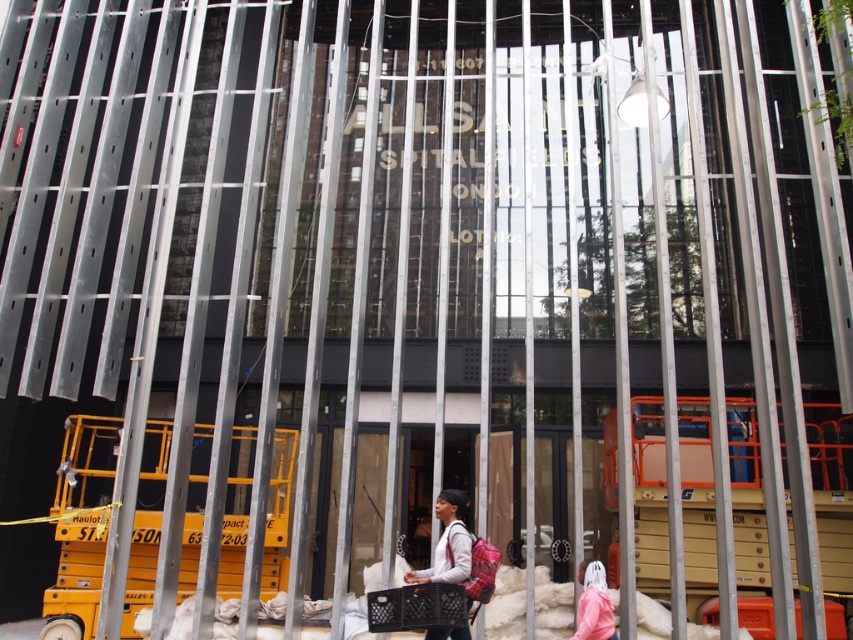
Question: Does plaid fabric backpack at center appear over pink fabric at lower right?

Choices:
 (A) yes
 (B) no

Answer: (B)

Question: Can you confirm if plaid fabric backpack at center is wider than pink fabric at lower right?

Choices:
 (A) yes
 (B) no

Answer: (B)

Question: Is plaid fabric backpack at center smaller than pink fabric at lower right?

Choices:
 (A) yes
 (B) no

Answer: (A)

Question: Which point is farther to the camera?

Choices:
 (A) plaid fabric backpack at center
 (B) pink fabric at lower right

Answer: (B)